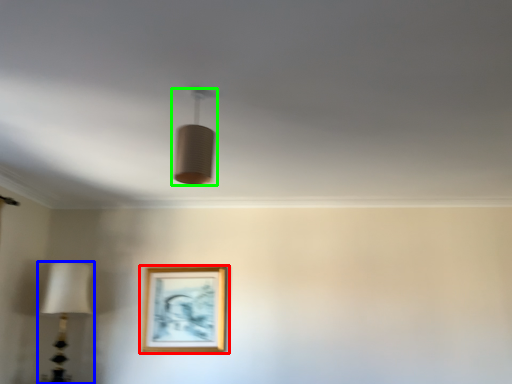
Question: Based on their relative distances, which object is nearer to picture frame (highlighted by a red box)? Choose from lamp (highlighted by a blue box) and lamp (highlighted by a green box).

Choices:
 (A) lamp
 (B) lamp

Answer: (A)